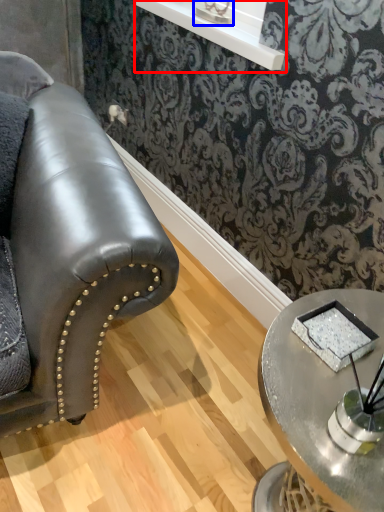
Question: Which of the following is the closest to the observer, window sill (highlighted by a red box) or table lamp (highlighted by a blue box)?

Choices:
 (A) window sill
 (B) table lamp

Answer: (A)